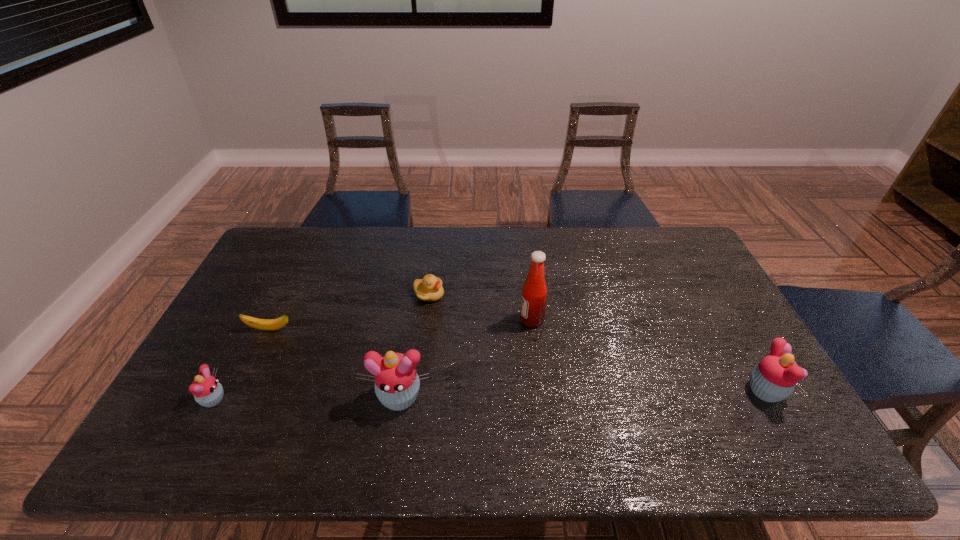
Please point a spot to place another cupcake for symmetrical spacing. Please provide its 2D coordinates. Your answer should be formatted as a tuple, i.e. [(x, y)], where the tuple contains the x and y coordinates of a point satisfying the conditions above.

[(584, 394)]